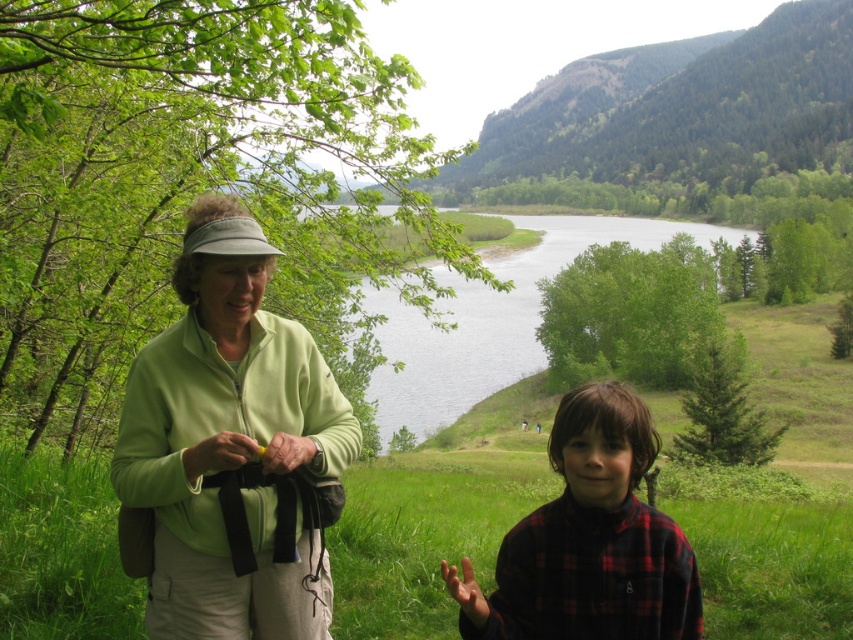
Does plaid flannel shirt at lower right have a lesser height compared to green grassy lake at center?

Yes, plaid flannel shirt at lower right is shorter than green grassy lake at center.

Does plaid flannel shirt at lower right have a lesser width compared to green grassy lake at center?

Indeed, plaid flannel shirt at lower right has a lesser width compared to green grassy lake at center.

The width and height of the screenshot is (853, 640). Find the location of `plaid flannel shirt at lower right`. plaid flannel shirt at lower right is located at coordinates (589, 540).

Can you confirm if green matte jacket at upper left is positioned to the left of plaid flannel shirt at lower right?

Yes, green matte jacket at upper left is to the left of plaid flannel shirt at lower right.

Which of these two, green matte jacket at upper left or plaid flannel shirt at lower right, stands shorter?

With less height is plaid flannel shirt at lower right.

The width and height of the screenshot is (853, 640). I want to click on green matte jacket at upper left, so click(230, 448).

Which is more to the right, green matte jacket at upper left or green grassy lake at center?

Positioned to the right is green grassy lake at center.

Does green matte jacket at upper left appear on the left side of green grassy lake at center?

Yes, green matte jacket at upper left is to the left of green grassy lake at center.

Is point (120, 429) more distant than point (442, 397)?

No.

Find the location of `green matte jacket at upper left`. green matte jacket at upper left is located at coordinates (230, 448).